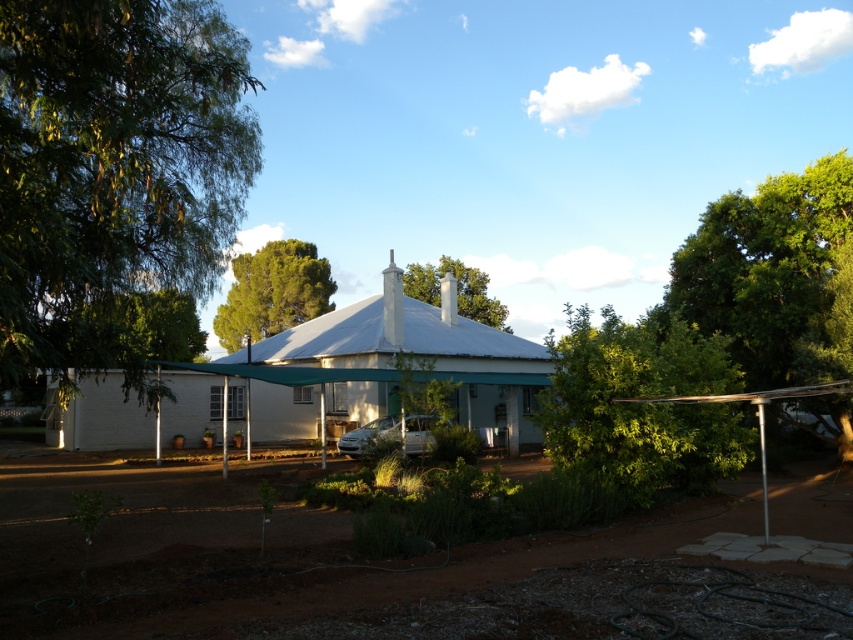
Question: Can you confirm if green leafy bush at center is bigger than green leafy tree at center?

Choices:
 (A) yes
 (B) no

Answer: (B)

Question: Is white fabric tent at center to the right of green leafy tree at center from the viewer's perspective?

Choices:
 (A) yes
 (B) no

Answer: (B)

Question: Which point is farther to the camera?

Choices:
 (A) (97, 410)
 (B) (160, 284)

Answer: (A)

Question: Does white fabric tent at center lie in front of green leafy tree at center?

Choices:
 (A) yes
 (B) no

Answer: (A)

Question: Which point is farther to the camera?

Choices:
 (A) (274, 435)
 (B) (120, 323)
 (C) (410, 292)
 (D) (675, 465)

Answer: (C)

Question: Which object is closer to the camera taking this photo?

Choices:
 (A) green leafy tree at center
 (B) green leafy bush at center
 (C) white fabric tent at center

Answer: (B)